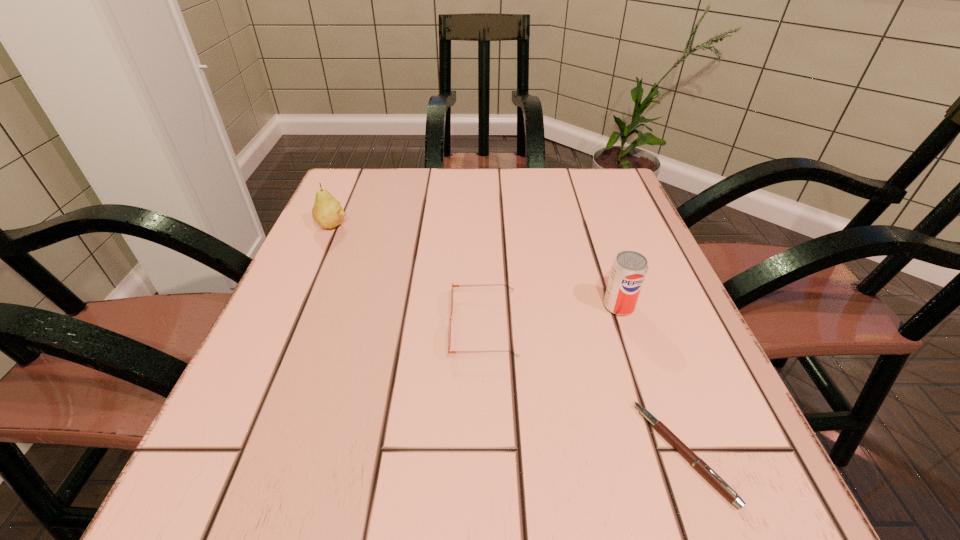
Where is `object located in the far left corner section of the desktop`? object located in the far left corner section of the desktop is located at coordinates (327, 211).

Locate an element on the screen. object situated at the near right corner is located at coordinates (705, 470).

In the image, there is a desktop. Identify the location of vacant area at the far edge. This screenshot has height=540, width=960. click(473, 197).

The width and height of the screenshot is (960, 540). I want to click on vacant space at the near edge, so click(x=369, y=488).

This screenshot has width=960, height=540. What are the coordinates of `vacant space at the left edge` in the screenshot? It's located at (230, 414).

In order to click on free space at the right edge of the desktop in this screenshot , I will do `click(592, 242)`.

Locate an element on the screen. The height and width of the screenshot is (540, 960). vacant space at the far left corner of the desktop is located at coordinates (363, 178).

Where is `vacant position at the far right corner of the desktop`? vacant position at the far right corner of the desktop is located at coordinates pos(601,178).

I want to click on vacant space at the near right corner, so click(x=684, y=468).

This screenshot has height=540, width=960. I want to click on vacant space that's between the sunglasses and the farthest object, so click(408, 276).